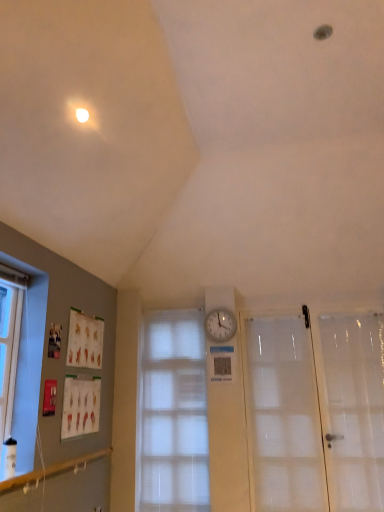
What do you see at coordinates (173, 413) in the screenshot? The width and height of the screenshot is (384, 512). I see `translucent fabric window at center` at bounding box center [173, 413].

Locate an element on the screen. white frosted glass door at right is located at coordinates (283, 415).

What do you see at coordinates (353, 408) in the screenshot?
I see `transparent plastic screen door at right` at bounding box center [353, 408].

Where is `translucent fabric window at center`? translucent fabric window at center is located at coordinates (173, 413).

Looking at their sizes, would you say transparent plastic screen door at right is wider or thinner than white plastic clock at center?

transparent plastic screen door at right is wider than white plastic clock at center.

You are a GUI agent. You are given a task and a screenshot of the screen. Output one action in this format:
    pyautogui.click(x=<x>, y=<y>)
    Task: Click on the clock located above the transparent plastic screen door at right (from the image's perspective)
    
    Given the screenshot: What is the action you would take?
    pyautogui.click(x=220, y=325)

How many degrees apart are the facing directions of transparent plastic screen door at right and white plastic clock at center?

The angle between the facing direction of transparent plastic screen door at right and the facing direction of white plastic clock at center is 1.86 degrees.

From the image's perspective, is transparent plastic screen door at right beneath white plastic clock at center?

Yes.

Which object is wider, white plastic clock at center or transparent plastic screen door at right?

With larger width is transparent plastic screen door at right.

From the image's perspective, would you say white plastic clock at center is shown under transparent plastic screen door at right?

No.

Considering the relative positions of white plastic clock at center and transparent plastic screen door at right in the image provided, is white plastic clock at center to the left or to the right of transparent plastic screen door at right?

Based on their positions, white plastic clock at center is located to the left of transparent plastic screen door at right.

Is white plastic clock at center far from transparent plastic screen door at right?

white plastic clock at center is far away from transparent plastic screen door at right.

Which object is wider, translucent fabric window at center or transparent plastic screen door at right?

transparent plastic screen door at right.

Can you confirm if translucent fabric window at center is bigger than transparent plastic screen door at right?

Correct, translucent fabric window at center is larger in size than transparent plastic screen door at right.

Identify the location of window to the left of transparent plastic screen door at right. (173, 413).

Considering the relative positions of translucent fabric window at center and transparent plastic screen door at right in the image provided, is translucent fabric window at center to the left or to the right of transparent plastic screen door at right?

translucent fabric window at center is to the left of transparent plastic screen door at right.

Find the location of a particular element. The image size is (384, 512). screen door that is above the translucent fabric window at center (from the image's perspective) is located at coordinates (353, 408).

Is transparent plastic screen door at right turned away from translucent fabric window at center?

No.

Are transparent plastic screen door at right and translucent fabric window at center located far from each other?

Indeed, transparent plastic screen door at right is not near translucent fabric window at center.

How many degrees apart are the facing directions of white frosted glass door at right and translucent fabric window at center?

The facing directions of white frosted glass door at right and translucent fabric window at center are 2.73 degrees apart.

From a real-world perspective, does white frosted glass door at right stand above translucent fabric window at center?

No, from a real-world perspective, white frosted glass door at right is not over translucent fabric window at center

Is point (258, 503) positioned before point (162, 365)?

Yes, it is.

Visually, is white frosted glass door at right positioned to the left or to the right of translucent fabric window at center?

From the image, it's evident that white frosted glass door at right is to the right of translucent fabric window at center.

From the image's perspective, would you say white plastic clock at center is positioned over translucent fabric window at center?

Yes, from the image's perspective, white plastic clock at center is on top of translucent fabric window at center.

Can you tell me how much white plastic clock at center and translucent fabric window at center differ in facing direction?

The angular difference between white plastic clock at center and translucent fabric window at center is 0.00466 degrees.

Which is closer, [232,335] or [148,505]?

Point [148,505]

In the scene shown: Does white plastic clock at center have a lesser height compared to translucent fabric window at center?

Yes, white plastic clock at center is shorter than translucent fabric window at center.

Considering the relative sizes of white plastic clock at center and white frosted glass door at right in the image provided, is white plastic clock at center smaller than white frosted glass door at right?

Yes, white plastic clock at center is smaller than white frosted glass door at right.

Looking at this image, in the image, is white plastic clock at center positioned in front of or behind white frosted glass door at right?

Visually, white plastic clock at center is located behind white frosted glass door at right.

Can you see white plastic clock at center touching white frosted glass door at right?

No, white plastic clock at center is not beside white frosted glass door at right.

Is white plastic clock at center positioned beyond the bounds of white frosted glass door at right?

Absolutely, white plastic clock at center is external to white frosted glass door at right.

Find the location of `clock that appears above the transparent plastic screen door at right (from the image's perspective)`. clock that appears above the transparent plastic screen door at right (from the image's perspective) is located at coordinates (220, 325).

I want to click on screen door directly beneath the white plastic clock at center (from a real-world perspective), so click(x=353, y=408).

When comparing their distances from translucent fabric window at center, does white plastic clock at center or white frosted glass door at right seem further?

white frosted glass door at right is further to translucent fabric window at center.

Considering their positions, is translucent fabric window at center positioned further to white frosted glass door at right than transparent plastic screen door at right?

translucent fabric window at center.

Looking at the image, which one is located further to white frosted glass door at right, white plastic clock at center or transparent plastic screen door at right?

Based on the image, white plastic clock at center appears to be further to white frosted glass door at right.

Looking at the image, which one is located further to white frosted glass door at right, white plastic clock at center or translucent fabric window at center?

white plastic clock at center is further to white frosted glass door at right.

Estimate the real-world distances between objects in this image. Which object is further from transparent plastic screen door at right, white frosted glass door at right or translucent fabric window at center?

translucent fabric window at center lies further to transparent plastic screen door at right than the other object.

Considering their positions, is white frosted glass door at right positioned further to translucent fabric window at center than white plastic clock at center?

Among the two, white frosted glass door at right is located further to translucent fabric window at center.

Based on their spatial positions, is translucent fabric window at center or white plastic clock at center further from white frosted glass door at right?

The object further to white frosted glass door at right is white plastic clock at center.

Looking at the image, which one is located closer to white plastic clock at center, white frosted glass door at right or transparent plastic screen door at right?

white frosted glass door at right is positioned closer to the anchor white plastic clock at center.

The width and height of the screenshot is (384, 512). I want to click on clock between translucent fabric window at center and transparent plastic screen door at right from left to right, so click(x=220, y=325).

Identify the location of door between white plastic clock at center and transparent plastic screen door at right. Image resolution: width=384 pixels, height=512 pixels. (283, 415).

Locate an element on the screen. This screenshot has height=512, width=384. clock between translucent fabric window at center and white frosted glass door at right is located at coordinates (220, 325).

Find the location of a particular element. The width and height of the screenshot is (384, 512). door located between translucent fabric window at center and transparent plastic screen door at right in the left-right direction is located at coordinates (283, 415).